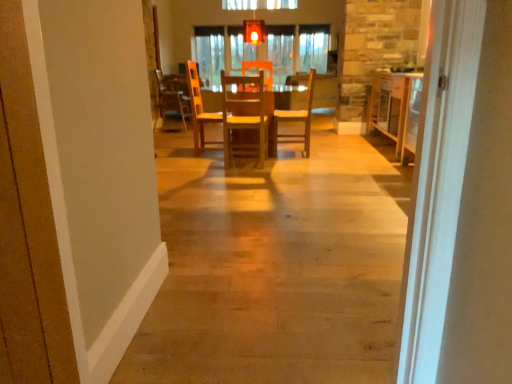
Question: Is wooden chair at center, which ranks as the 2th chair in back-to-front order, outside wooden table at center, which is the 2th table from left to right?

Choices:
 (A) yes
 (B) no

Answer: (A)

Question: From the image's perspective, is wooden chair at center, the third chair when ordered from left to right, over wooden table at center, marked as the 1th table in a right-to-left arrangement?

Choices:
 (A) yes
 (B) no

Answer: (B)

Question: Considering the relative sizes of wooden chair at center, the third chair when ordered from left to right, and wooden table at center, marked as the 1th table in a right-to-left arrangement, in the image provided, is wooden chair at center, the third chair when ordered from left to right, bigger than wooden table at center, marked as the 1th table in a right-to-left arrangement,?

Choices:
 (A) no
 (B) yes

Answer: (A)

Question: Considering the relative sizes of wooden chair at center, the second chair positioned from the front, and wooden table at center, marked as the 1th table in a right-to-left arrangement, in the image provided, is wooden chair at center, the second chair positioned from the front, smaller than wooden table at center, marked as the 1th table in a right-to-left arrangement,?

Choices:
 (A) no
 (B) yes

Answer: (B)

Question: From a real-world perspective, is wooden chair at center, marked as the first chair in a right-to-left arrangement, over wooden table at center, which is the 2th table from left to right?

Choices:
 (A) yes
 (B) no

Answer: (A)

Question: Is wooden chair at center, which ranks as the 2th chair in back-to-front order, facing towards wooden table at center, which is the 2th table from left to right?

Choices:
 (A) no
 (B) yes

Answer: (A)

Question: Can wooden chair at center, the second chair positioned from the front, be found inside matte glass light fixture at upper center?

Choices:
 (A) yes
 (B) no

Answer: (B)

Question: From the image's perspective, is matte glass light fixture at upper center over wooden chair at center, the second chair positioned from the front?

Choices:
 (A) yes
 (B) no

Answer: (A)

Question: From a real-world perspective, is matte glass light fixture at upper center on top of wooden chair at center, which ranks as the 2th chair in back-to-front order?

Choices:
 (A) yes
 (B) no

Answer: (A)

Question: Is matte glass light fixture at upper center bigger than wooden chair at center, which ranks as the 2th chair in back-to-front order?

Choices:
 (A) no
 (B) yes

Answer: (A)

Question: Considering the relative sizes of matte glass light fixture at upper center and wooden chair at center, marked as the first chair in a right-to-left arrangement, in the image provided, is matte glass light fixture at upper center taller than wooden chair at center, marked as the first chair in a right-to-left arrangement,?

Choices:
 (A) yes
 (B) no

Answer: (B)

Question: From the image's perspective, is matte glass light fixture at upper center located beneath wooden chair at center, the third chair when ordered from left to right?

Choices:
 (A) yes
 (B) no

Answer: (B)

Question: Is wooden chair at center, which ranks as the 2th chair in back-to-front order, at the right side of wooden table at center, the second table when ordered from right to left?

Choices:
 (A) yes
 (B) no

Answer: (A)